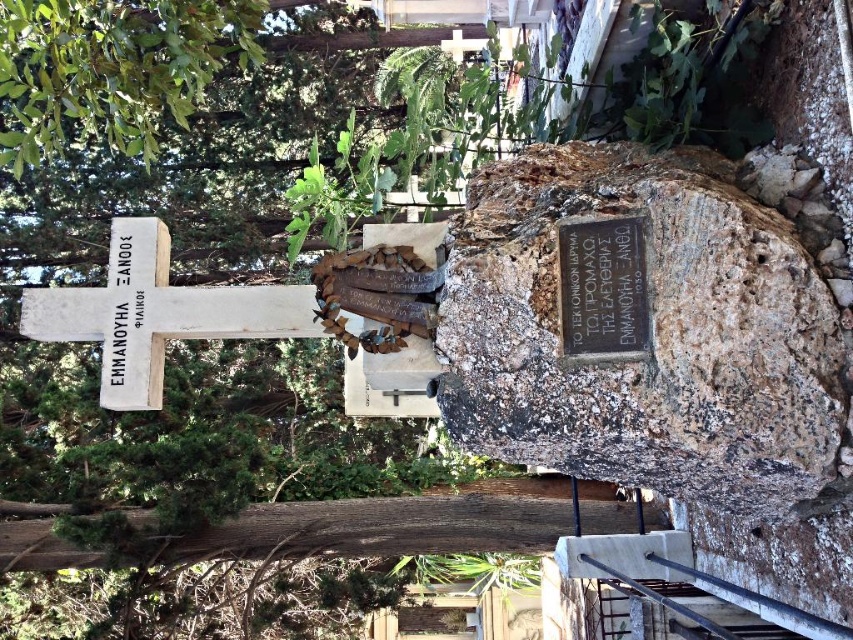
You are a historian examining the cemetery scene. You need to determine the spatial relationship between the rusty stone plaque at center and the white stone cross at upper left. Which object is closer to the viewer?

The rusty stone plaque at center is closer to the viewer because it is in front of the white stone cross at upper left.

You are a historian examining the cemetery scene. You need to determine which object is wider between the rusty stone plaque at center and the white stone cross at left. Which one is wider?

The rusty stone plaque at center is wider than the white stone cross at left according to the description provided.

You are standing in a cemetery and want to read the inscriptions on the rusty stone plaque at center. Given that you can reach up to 6 feet, can you comfortably read the text without moving closer?

The rusty stone plaque at center is 7.50 feet away from the viewer, which is beyond your reach of 6 feet. Therefore, you cannot comfortably read the text without moving closer.